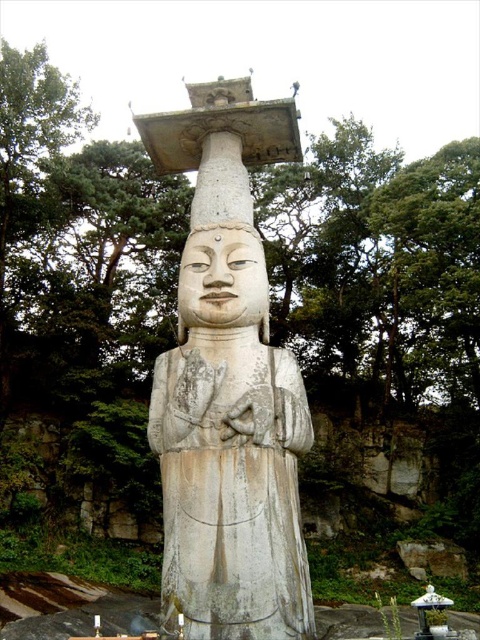
Is white stone statue at center positioned at the back of white stone head at center?

No, white stone statue at center is closer to the viewer.

In the scene shown: Who is shorter, white stone statue at center or white stone head at center?

Standing shorter between the two is white stone head at center.

This screenshot has height=640, width=480. In order to click on white stone statue at center in this screenshot , I will do `click(228, 385)`.

Locate an element on the screen. white stone statue at center is located at coordinates (228, 385).